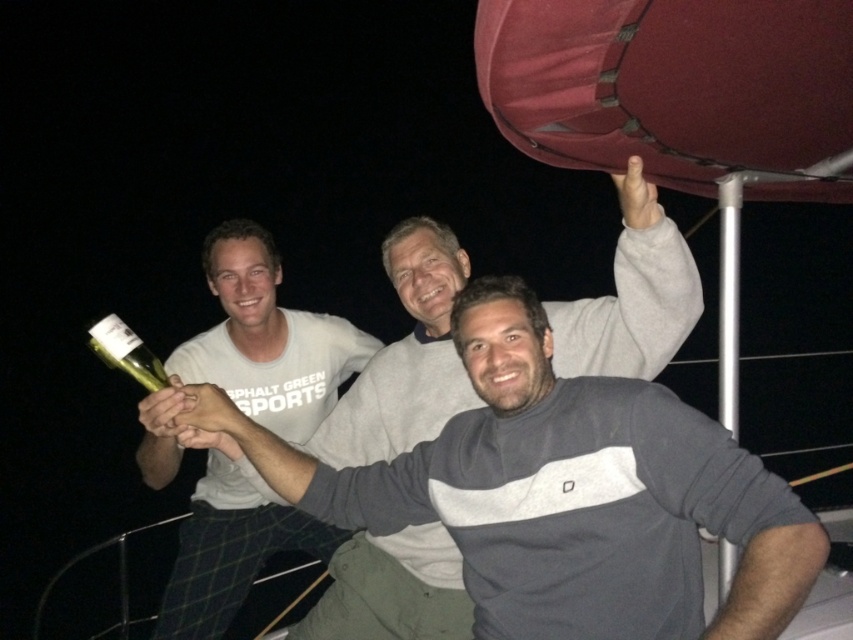
What do you see at coordinates (405, 356) in the screenshot? Image resolution: width=853 pixels, height=640 pixels. I see `gray cotton shirt at center` at bounding box center [405, 356].

Is gray cotton shirt at center taller than white matte t-shirt at left?

No.

I want to click on gray cotton shirt at center, so click(x=405, y=356).

Does white matte t-shirt at left have a greater height compared to green glass bottle at lower left?

Yes, white matte t-shirt at left is taller than green glass bottle at lower left.

Which is more to the right, white matte t-shirt at left or green glass bottle at lower left?

white matte t-shirt at left is more to the right.

Does point (267, 420) come farther from viewer compared to point (161, 378)?

That is True.

In order to click on white matte t-shirt at left in this screenshot , I will do `click(267, 339)`.

In the scene shown: Is gray cotton shirt at center smaller than green glass bottle at lower left?

No.

Is gray cotton shirt at center positioned in front of green glass bottle at lower left?

That is False.

Measure the distance between gray cotton shirt at center and camera.

gray cotton shirt at center is 6.12 feet from camera.

Find the location of a particular element. This screenshot has height=640, width=853. gray cotton shirt at center is located at coordinates (405, 356).